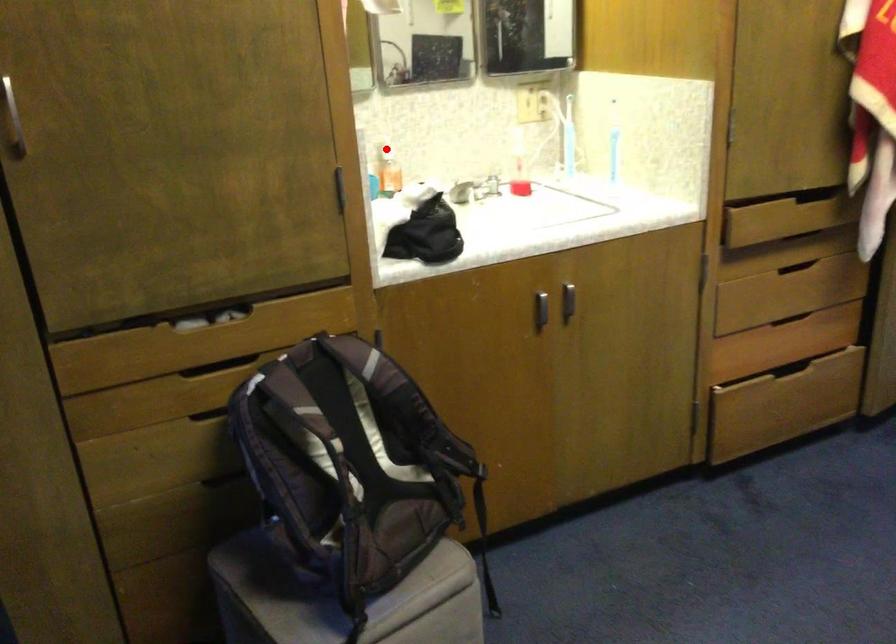
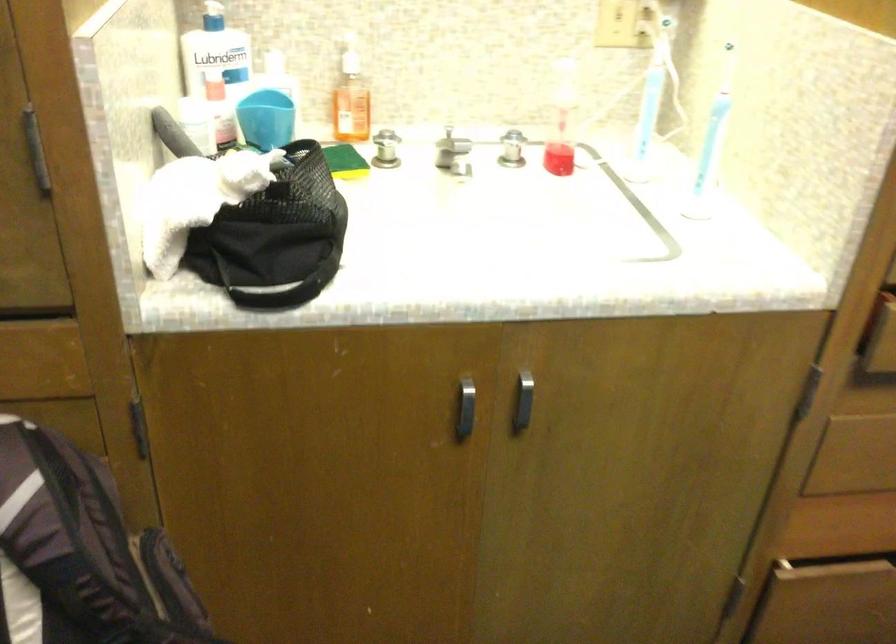
Locate, in the second image, the point that corresponds to the highlighted location in the first image.

(349, 59)